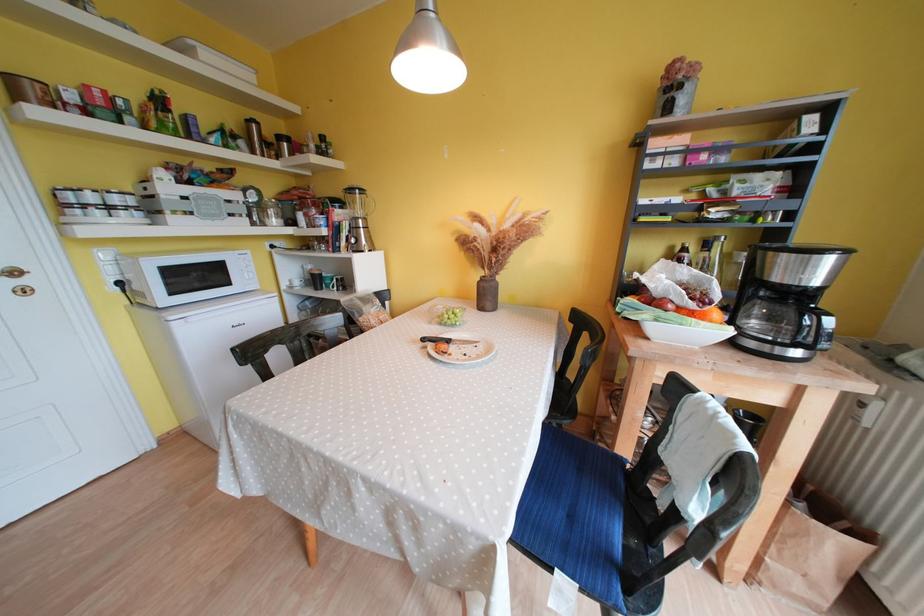
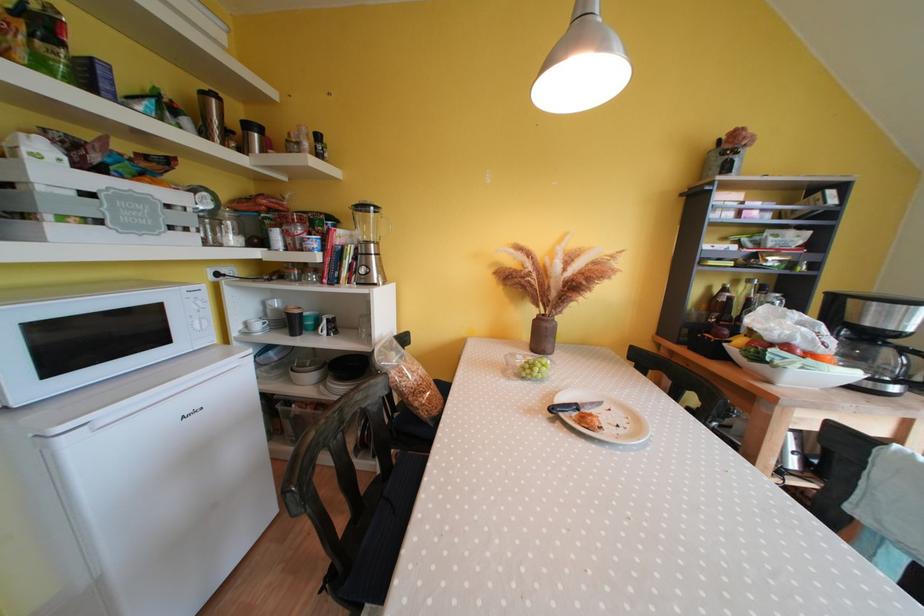
In the second image, find the point that corresponds to the point at 367,224 in the first image.

(379, 249)